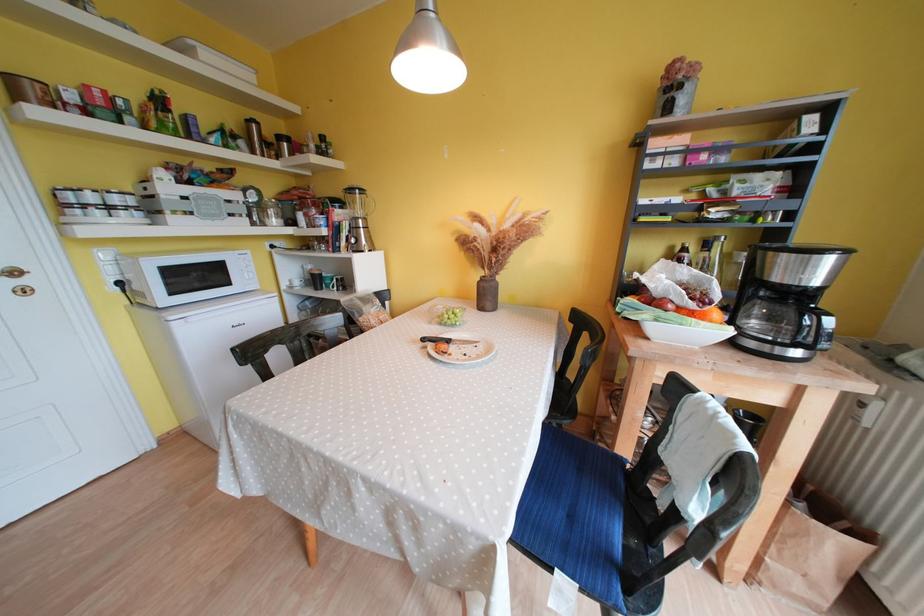
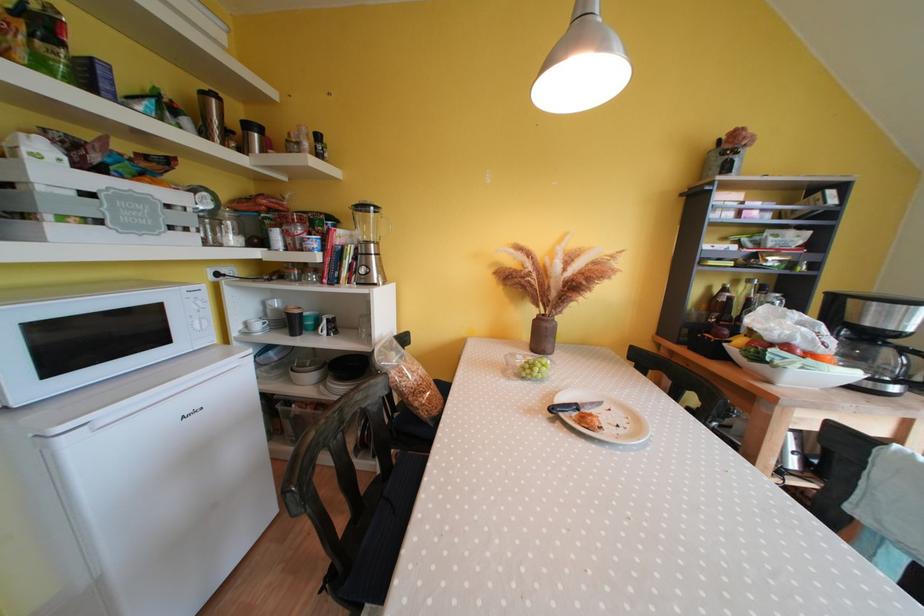
In the second image, find the point that corresponds to the point at 367,224 in the first image.

(379, 249)